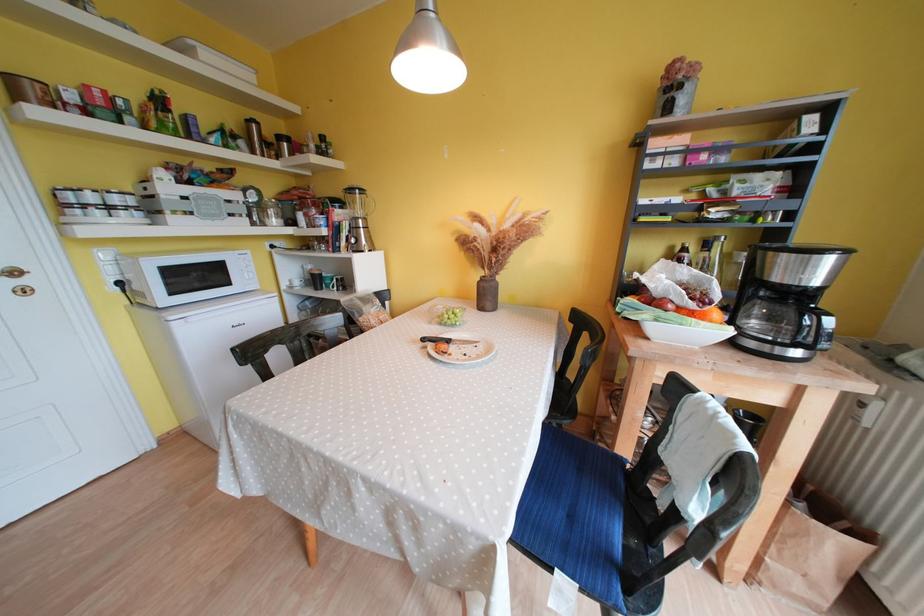
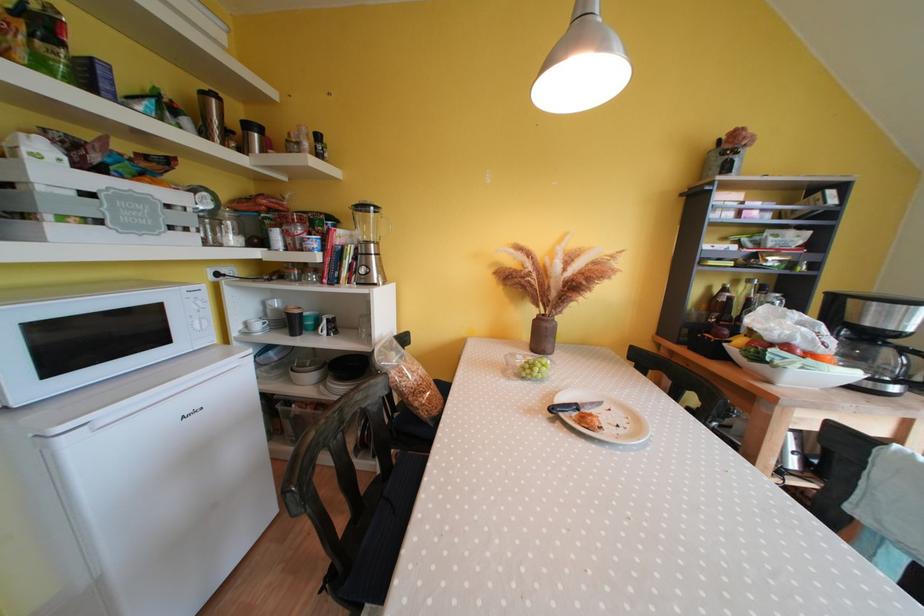
In the second image, find the point that corresponds to the point at 367,224 in the first image.

(379, 249)